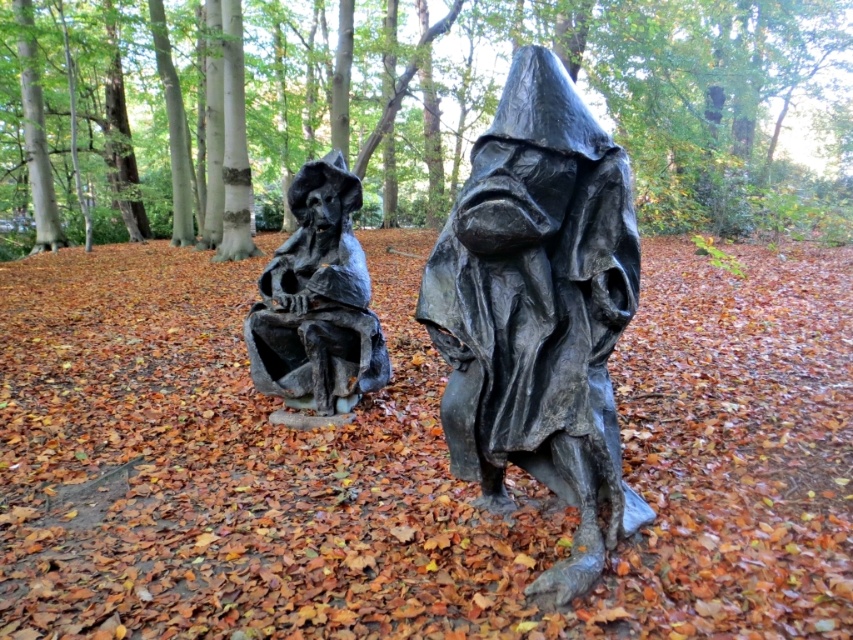
Question: Does matte black figure at center have a lesser width compared to matte black statue at center?

Choices:
 (A) yes
 (B) no

Answer: (B)

Question: Is matte black figure at center wider than matte black statue at center?

Choices:
 (A) yes
 (B) no

Answer: (A)

Question: Among these points, which one is nearest to the camera?

Choices:
 (A) (466, 218)
 (B) (331, 337)

Answer: (A)

Question: Is matte black figure at center to the right of matte black statue at center from the viewer's perspective?

Choices:
 (A) no
 (B) yes

Answer: (B)